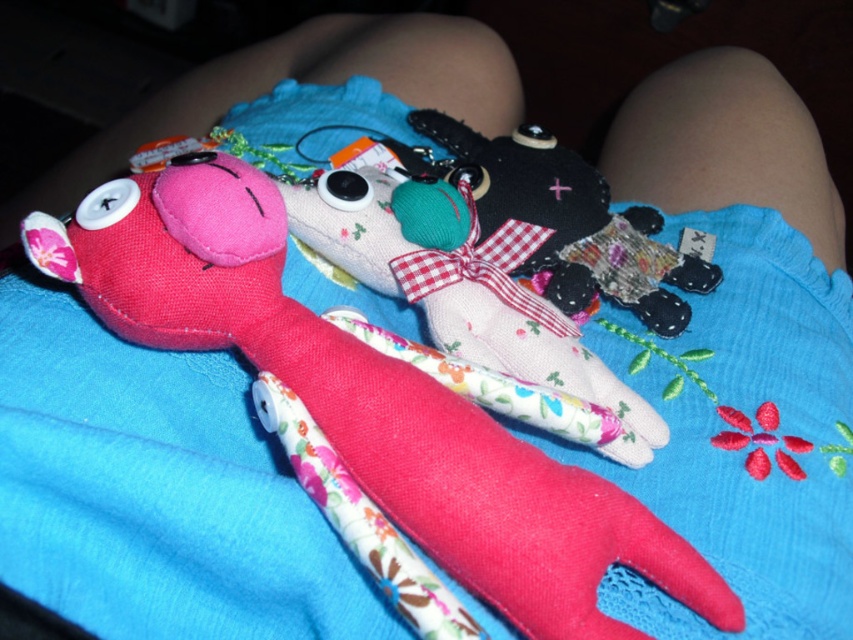
How far apart are the pink fish toy and the floral fabric stuffed animal at center?

The pink fish toy and the floral fabric stuffed animal at center are 21.23 inches apart.

You are a child trying to reach both the floral fabric stuffed animal at center and the flannel fabric stuffed animal at center. Which one can you grab first without moving your hand?

The floral fabric stuffed animal at center is closer to the viewer than the flannel fabric stuffed animal at center, so you can grab it first without moving your hand.